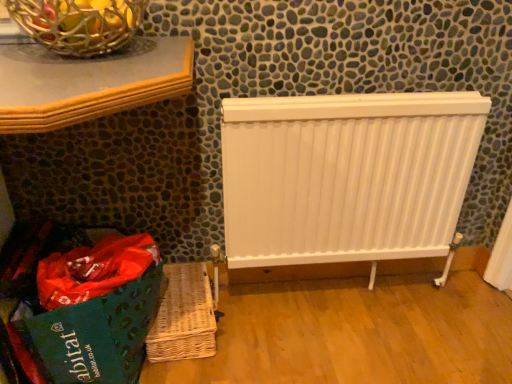
What are the coordinates of `free space to the right of white matte radiator at center` in the screenshot? It's located at (432, 312).